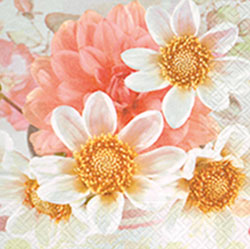
Image resolution: width=250 pixels, height=249 pixels. What are the coordinates of `white background of tablecloth` in the screenshot? It's located at 63,2, 20,143.